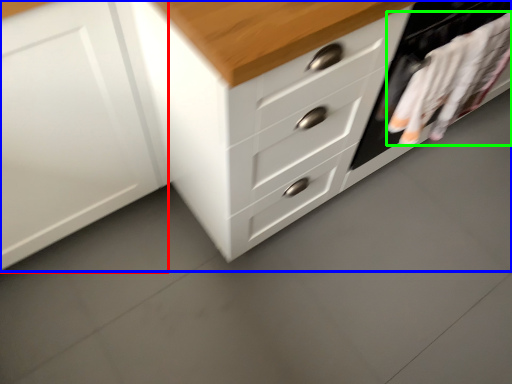
Question: Which is farther away from cabinetry (highlighted by a red box)? chest of drawers (highlighted by a blue box) or laundry (highlighted by a green box)?

Choices:
 (A) chest of drawers
 (B) laundry

Answer: (B)